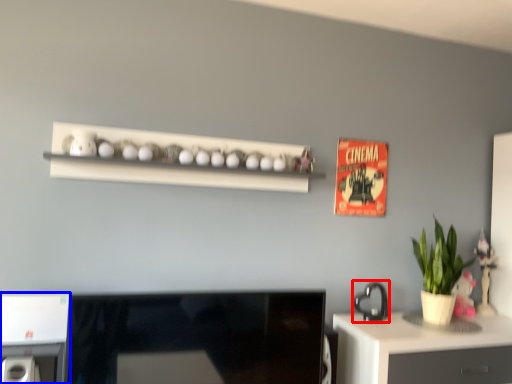
Question: Among these objects, which one is farthest to the camera, appliance (highlighted by a red box) or appliance (highlighted by a blue box)?

Choices:
 (A) appliance
 (B) appliance

Answer: (A)